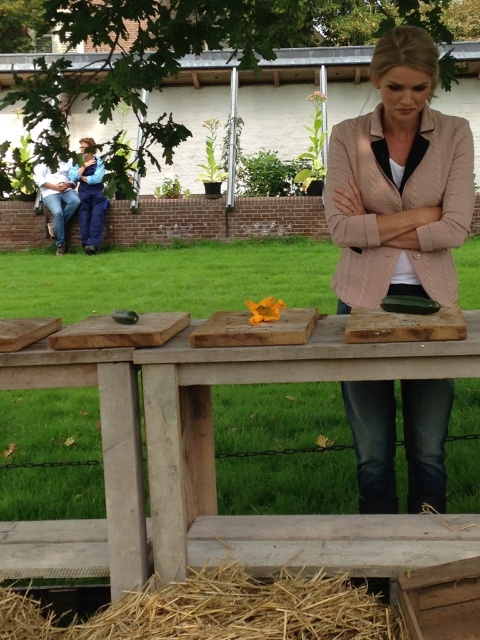
Question: Can you confirm if blue denim jacket at left is thinner than wooden cutting board at center?

Choices:
 (A) yes
 (B) no

Answer: (A)

Question: Does blue denim jacket at left have a smaller size compared to wooden cutting board at center?

Choices:
 (A) no
 (B) yes

Answer: (B)

Question: Which object is positioned farthest from the orange paper at center?

Choices:
 (A) wooden picnic table at center
 (B) matte pink blazer at center
 (C) wooden cutting board at center
 (D) blue denim jacket at left

Answer: (D)

Question: Considering the real-world distances, which object is closest to the golden straw at lower center?

Choices:
 (A) wooden picnic table at center
 (B) blue denim jacket at left

Answer: (A)

Question: Which point is farther from the camera taking this photo?

Choices:
 (A) (266, 301)
 (B) (292, 372)
 (C) (126, 321)

Answer: (A)

Question: Does golden straw at lower center appear on the right side of orange paper at center?

Choices:
 (A) yes
 (B) no

Answer: (B)